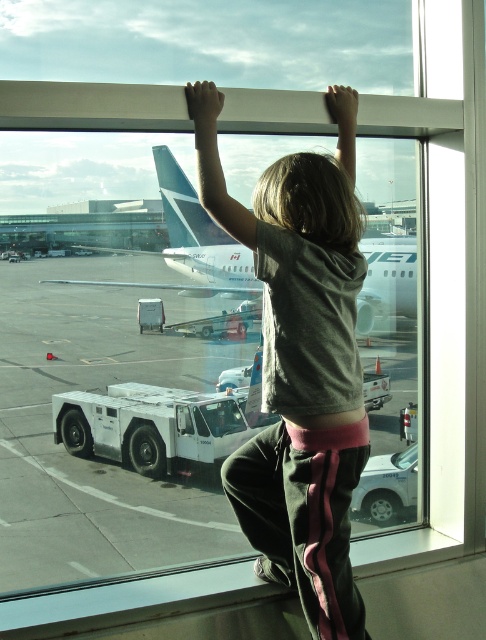
Question: Can you confirm if gray cotton shirt at upper center is thinner than white matte airplane at center?

Choices:
 (A) yes
 (B) no

Answer: (A)

Question: Which object is closer to the camera taking this photo?

Choices:
 (A) gray cotton shirt at upper center
 (B) white matte airplane at center

Answer: (A)

Question: Among these points, which one is nearest to the camera?

Choices:
 (A) (391, 234)
 (B) (316, 620)

Answer: (B)

Question: Is the position of gray cotton shirt at upper center more distant than that of white matte airplane at center?

Choices:
 (A) no
 (B) yes

Answer: (A)

Question: Which of the following is the farthest from the observer?

Choices:
 (A) gray cotton shirt at upper center
 (B) white matte airplane at center

Answer: (B)

Question: Is gray cotton shirt at upper center behind white matte airplane at center?

Choices:
 (A) yes
 (B) no

Answer: (B)